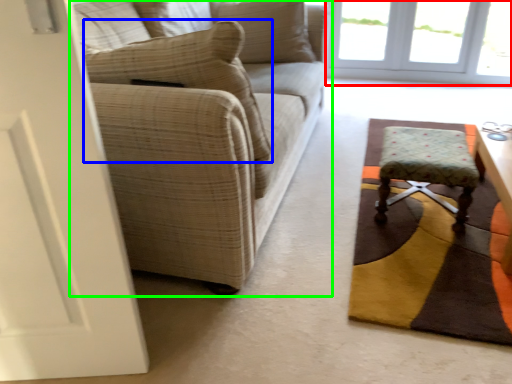
Question: Which object is the farthest from window (highlighted by a red box)? Choose among these: pillow (highlighted by a blue box) or studio couch (highlighted by a green box).

Choices:
 (A) pillow
 (B) studio couch

Answer: (A)